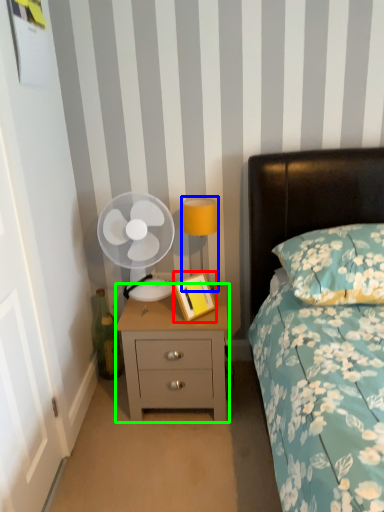
Question: Which object is the farthest from picture frame (highlighted by a red box)? Choose among these: bedside lamp (highlighted by a blue box) or nightstand (highlighted by a green box).

Choices:
 (A) bedside lamp
 (B) nightstand

Answer: (A)